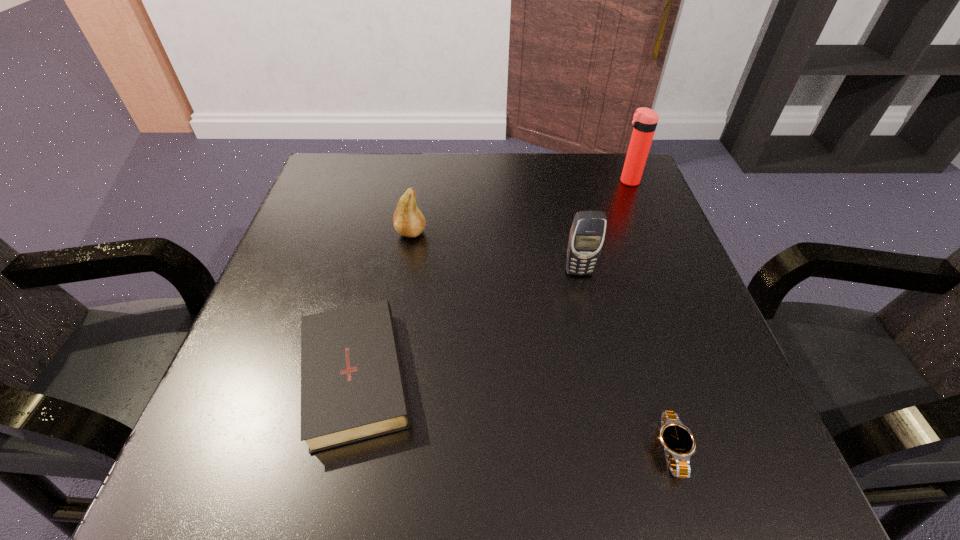
Find the location of `free space that is in between the second object from right to left and the second shortest object`. free space that is in between the second object from right to left and the second shortest object is located at coordinates (515, 407).

Locate an element on the screen. vacant space in between the second shortest object and the farthest object is located at coordinates (493, 273).

At what (x,y) coordinates should I click in order to perform the action: click on empty space between the third object from left to right and the second shortest object. Please return your answer as a coordinate pair (x, y). Looking at the image, I should click on (468, 318).

Locate an element on the screen. The height and width of the screenshot is (540, 960). vacant point located between the farthest object and the third shortest object is located at coordinates (519, 207).

This screenshot has height=540, width=960. What are the coordinates of `vacant region between the second object from right to left and the rightmost object` in the screenshot? It's located at (649, 315).

Where is `free space between the fourth object from left to right and the tallest object`? Image resolution: width=960 pixels, height=540 pixels. free space between the fourth object from left to right and the tallest object is located at coordinates (649, 315).

What are the coordinates of `free spot between the watch and the fourth nearest object` in the screenshot? It's located at (540, 341).

The image size is (960, 540). I want to click on unoccupied position between the Bible and the second farthest object, so [385, 299].

What are the coordinates of `object that is the second closest to the second farthest object` in the screenshot? It's located at (587, 234).

Locate which object is the third closest to the pear. Please provide its 2D coordinates. Your answer should be formatted as a tuple, i.e. [(x, y)], where the tuple contains the x and y coordinates of a point satisfying the conditions above.

[(645, 120)]